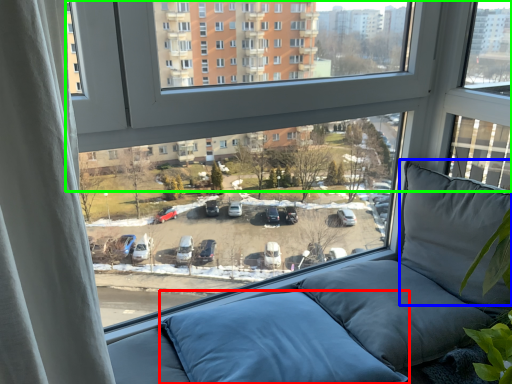
Question: Which is farther away from pillow (highlighted by a red box)? pillow (highlighted by a blue box) or window (highlighted by a green box)?

Choices:
 (A) pillow
 (B) window

Answer: (B)